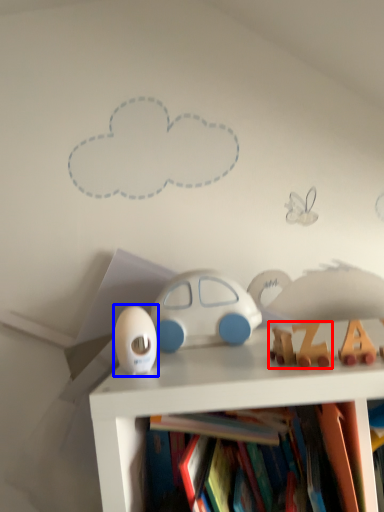
Question: Which object is further to the camera taking this photo, toy (highlighted by a red box) or toy (highlighted by a blue box)?

Choices:
 (A) toy
 (B) toy

Answer: (B)